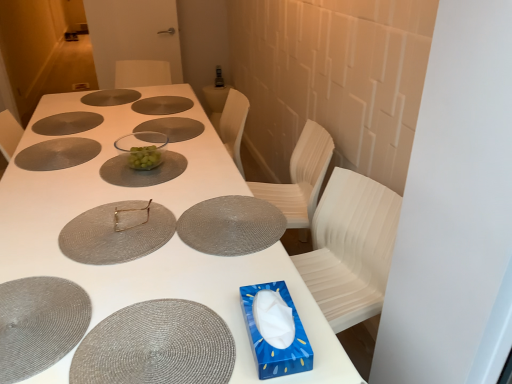
At what (x,y) coordinates should I click in order to perform the action: click on free space above matte gray glass plate at upper left, which is the 5th glass plate in back-to-front order (from a real-world perspective). Please return your answer as a coordinate pair (x, y). This screenshot has width=512, height=384. Looking at the image, I should click on (53, 147).